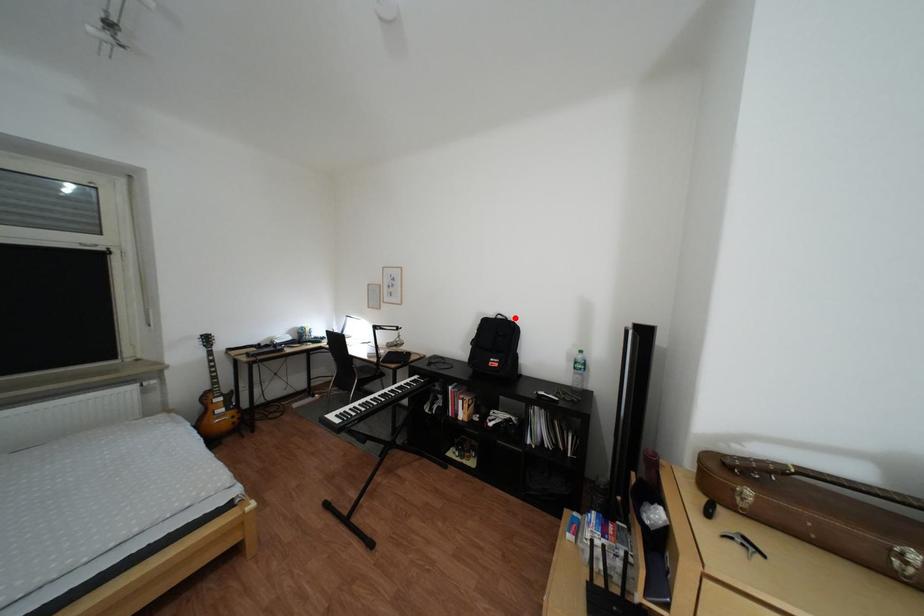
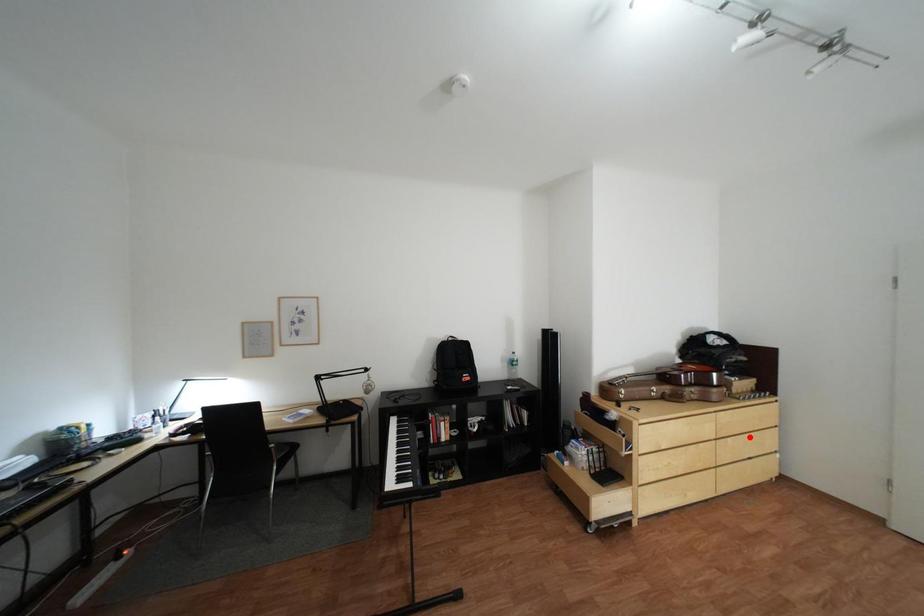
I am providing you with two images of the same scene from different viewpoints. A red point is marked on the first image and another point is marked on the second image. Is the red point in image1 aligned with the point shown in image2?

No